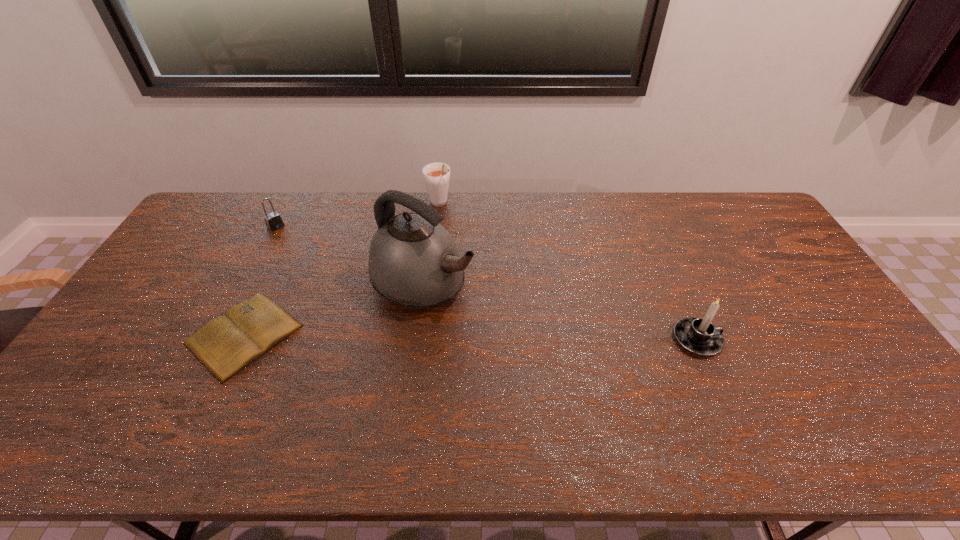
Locate an element on the screen. vacant point at the far edge is located at coordinates (512, 210).

The height and width of the screenshot is (540, 960). Find the location of `vacant area at the near edge of the desktop`. vacant area at the near edge of the desktop is located at coordinates pos(827,401).

Locate an element on the screen. The image size is (960, 540). vacant region at the left edge is located at coordinates click(x=157, y=301).

Locate an element on the screen. The image size is (960, 540). vacant space at the right edge of the desktop is located at coordinates (733, 240).

Where is `vacant space at the far left corner`? The height and width of the screenshot is (540, 960). vacant space at the far left corner is located at coordinates (218, 214).

The height and width of the screenshot is (540, 960). Find the location of `vacant region at the near right corner of the desktop`. vacant region at the near right corner of the desktop is located at coordinates pyautogui.click(x=862, y=379).

You are a GUI agent. You are given a task and a screenshot of the screen. Output one action in this format:
    pyautogui.click(x=<x>, y=<y>)
    Task: Click on the blank region between the tallest object and the candle holder
    
    Given the screenshot: What is the action you would take?
    pyautogui.click(x=560, y=311)

This screenshot has width=960, height=540. In order to click on vacant space in between the rightmost object and the tallest object in this screenshot , I will do `click(560, 311)`.

What are the coordinates of `vacant point located between the kettle and the shortest object` in the screenshot? It's located at (334, 309).

What are the coordinates of `free space between the padlock and the book` in the screenshot? It's located at (260, 281).